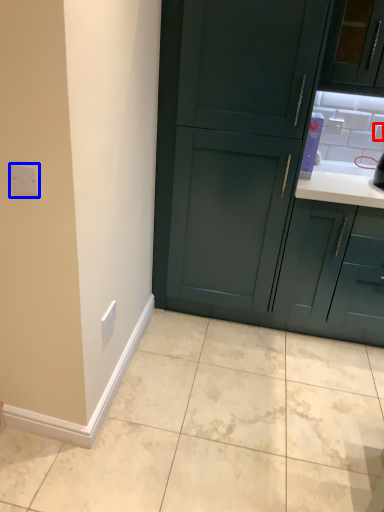
Question: Which point is closer to the camera, electric outlet (highlighted by a red box) or electric outlet (highlighted by a blue box)?

Choices:
 (A) electric outlet
 (B) electric outlet

Answer: (B)